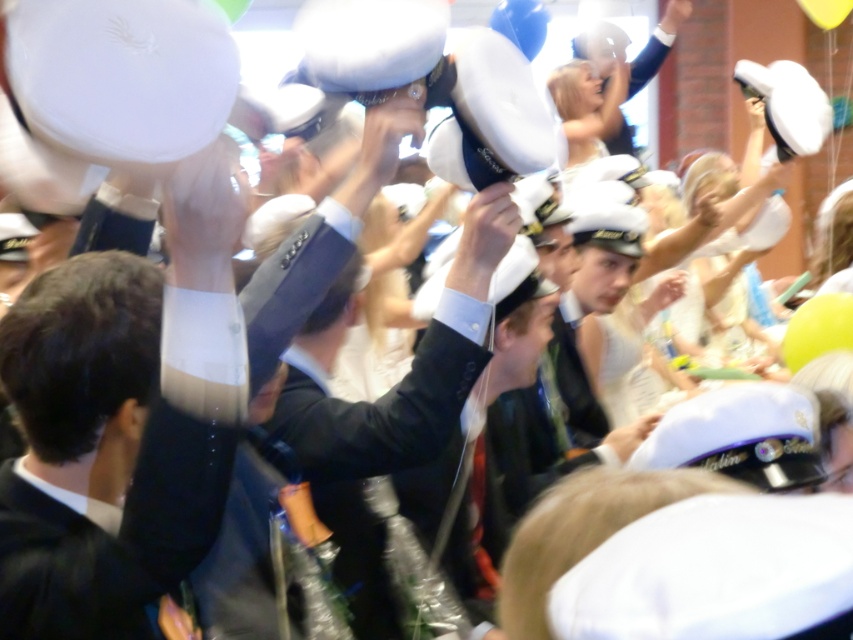
You are standing in the crowd at this event and want to take a photo of the shiny black suit at center. If your camera has a minimum focus distance of 6 feet, can you capture a clear photo without moving closer?

→ The shiny black suit at center is 6.20 feet away from the viewer. Since the camera requires a minimum focus distance of 6 feet, the suit is just beyond the required distance. However, most cameras can still focus slightly beyond the minimum distance, so it might be possible to capture a clear photo without moving closer. Alternatively, zooming in could help achieve focus.

You are a photographer standing at the back of the event venue. You want to take a photo that includes both the shiny black suit at center and the blue rubber balloon at upper center. Given that your camera has a maximum focus range of 6 meters, will you be able to capture both objects in focus without moving closer?

The distance between the shiny black suit at center and the blue rubber balloon at upper center is 6.75 meters. Since your camera can only focus up to 6 meters, capturing both in focus without moving closer is not possible.

You are at the center of the scene and want to find the shiny black suit at center. Based on the coordinates provided, in which direction should you look to locate it?

The shiny black suit at center is located at coordinates point (160, 429), so you should look to your right and slightly downward to locate it.